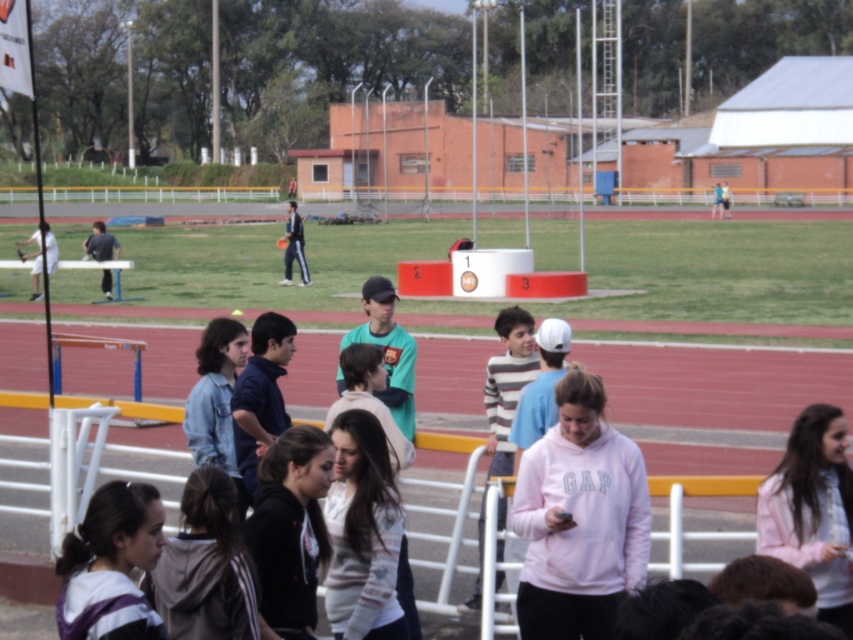
Who is higher up, purple striped hoodie at lower left or dark blue suit at center?

dark blue suit at center

Consider the image. How distant is purple striped hoodie at lower left from dark blue suit at center?

purple striped hoodie at lower left is 33.20 meters away from dark blue suit at center.

Where is `purple striped hoodie at lower left`? purple striped hoodie at lower left is located at coordinates (109, 564).

Is pink fleece sweatshirt at center shorter than white matte tennis racket at left?

Yes, pink fleece sweatshirt at center is shorter than white matte tennis racket at left.

Measure the distance between point (573, 374) and camera.

Point (573, 374) is 7.42 meters away from camera.

Who is more distant from viewer, (579, 630) or (41, 237)?

Point (41, 237)

Locate an element on the screen. The width and height of the screenshot is (853, 640). pink fleece sweatshirt at center is located at coordinates (579, 518).

Which is above, pink fleece sweatshirt at center or dark blue suit at center?

dark blue suit at center is above.

Does pink fleece sweatshirt at center appear on the left side of dark blue suit at center?

Incorrect, pink fleece sweatshirt at center is not on the left side of dark blue suit at center.

The height and width of the screenshot is (640, 853). Identify the location of pink fleece sweatshirt at center. (579, 518).